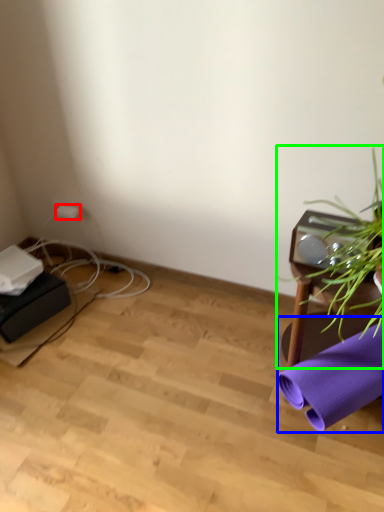
Question: Which is nearer to the plug (highlighted by a red box)? beach towel (highlighted by a blue box) or houseplant (highlighted by a green box).

Choices:
 (A) beach towel
 (B) houseplant

Answer: (B)